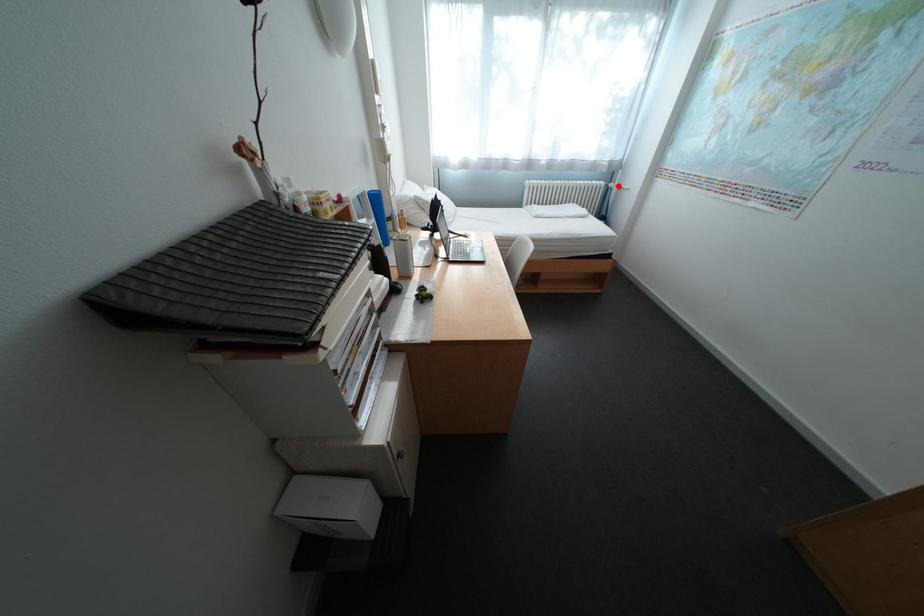
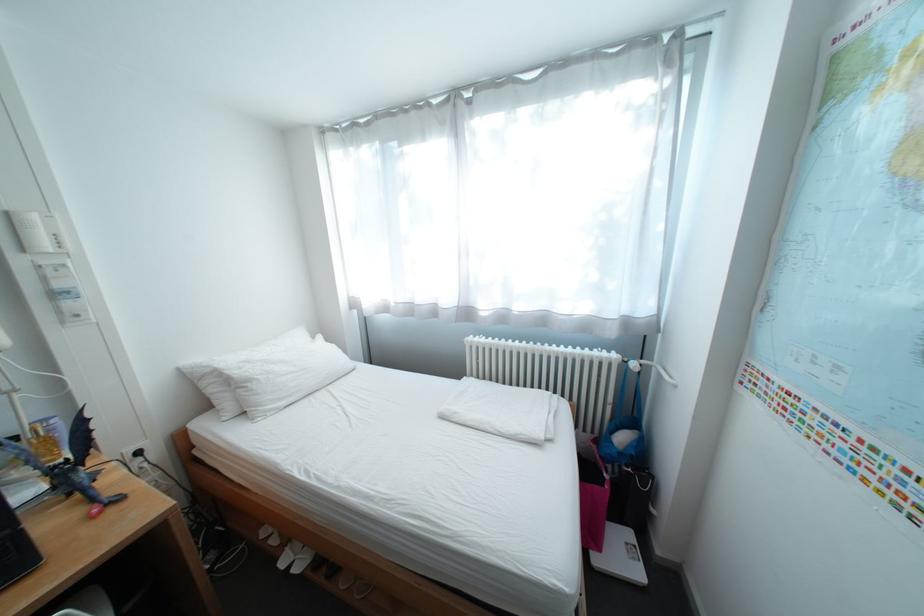
Question: I am providing you with two images of the same scene from different viewpoints. A red point is shown in image1. For the corresponding object point in image2, is it positioned nearer or farther from the camera?

Choices:
 (A) Nearer
 (B) Farther

Answer: (B)